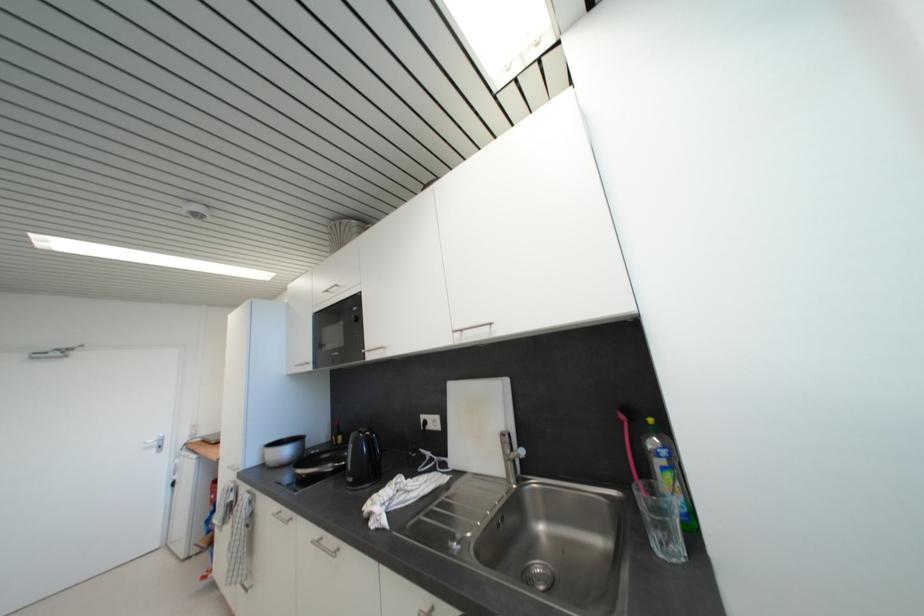
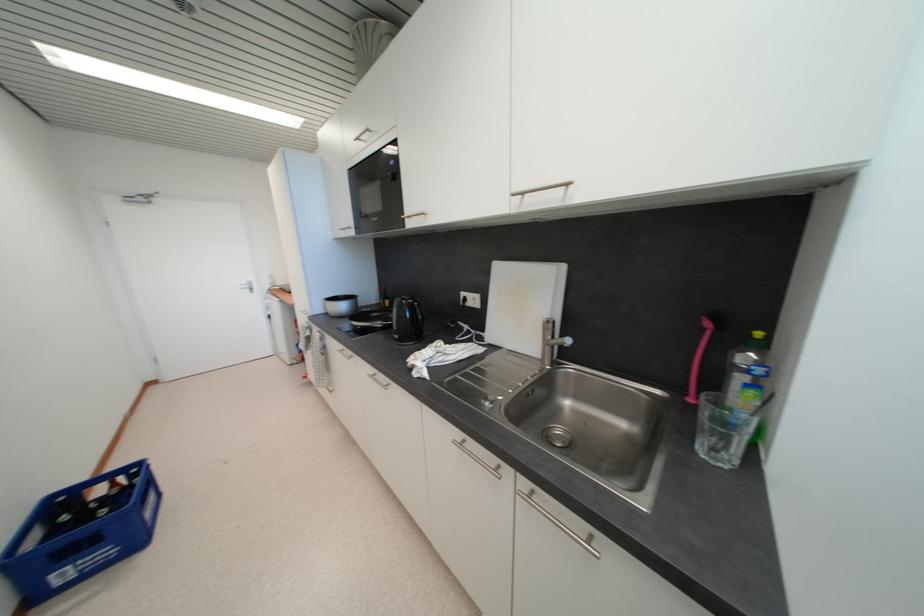
Find the pixel in the second image that matches point 269,467 in the first image.

(332, 315)